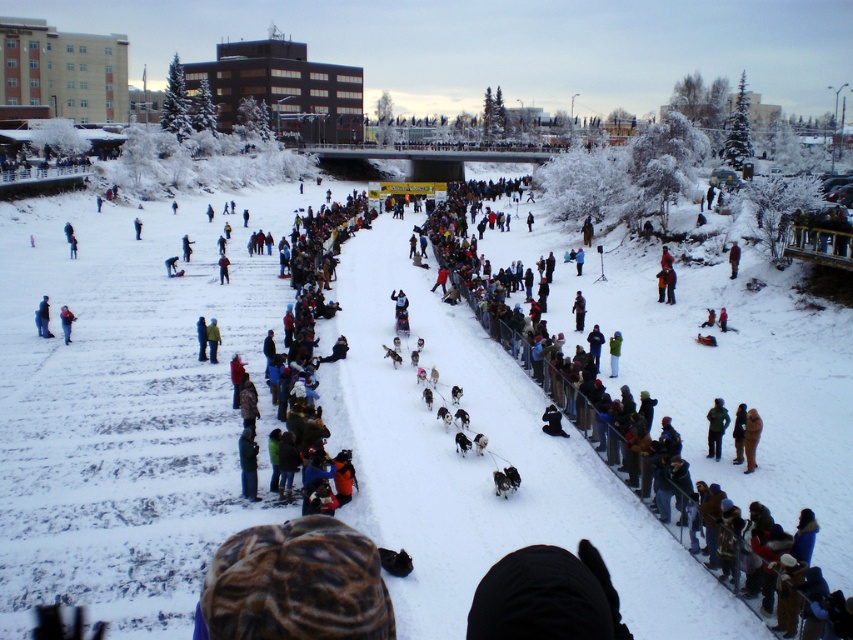
Question: Can you confirm if blue fabric jacket at center is wider than light brown fur coat at lower left?

Choices:
 (A) no
 (B) yes

Answer: (B)

Question: Does light brown fur coat at lower left appear on the left side of dark green jacket at center?

Choices:
 (A) yes
 (B) no

Answer: (A)

Question: Among these points, which one is nearest to the camera?

Choices:
 (A) (202, 339)
 (B) (733, 260)

Answer: (A)

Question: Which is farther from the blue fabric jacket at center?

Choices:
 (A) green wool jacket at center
 (B) light brown fur coat at lower left
 (C) brown fuzzy coat at lower right
 (D) white snow at center

Answer: (B)

Question: Which point appears closest to the camera in this image?

Choices:
 (A) (201, 340)
 (B) (730, 260)
 (C) (44, 323)

Answer: (A)

Question: Does blue fabric jacket at center appear over blue woolen hat at center?

Choices:
 (A) no
 (B) yes

Answer: (A)